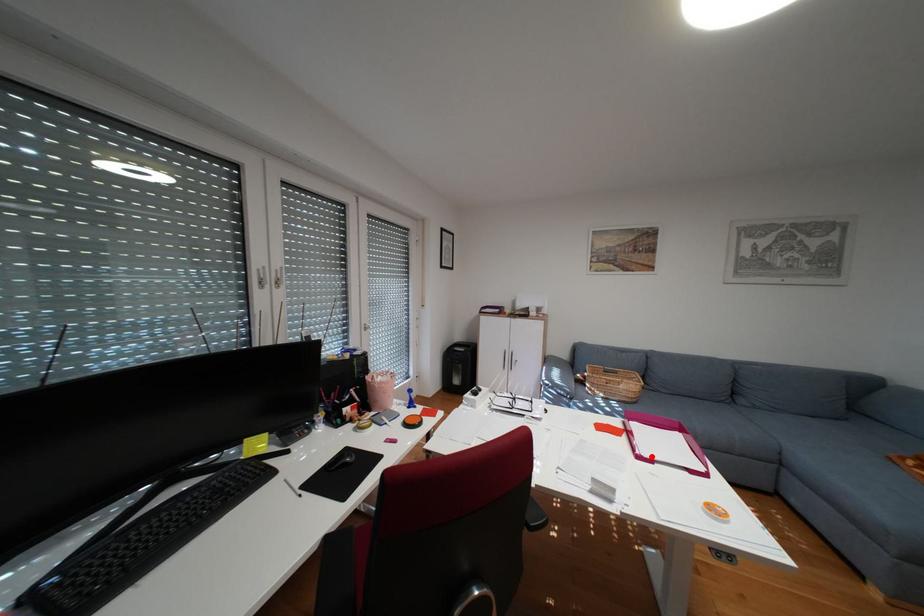
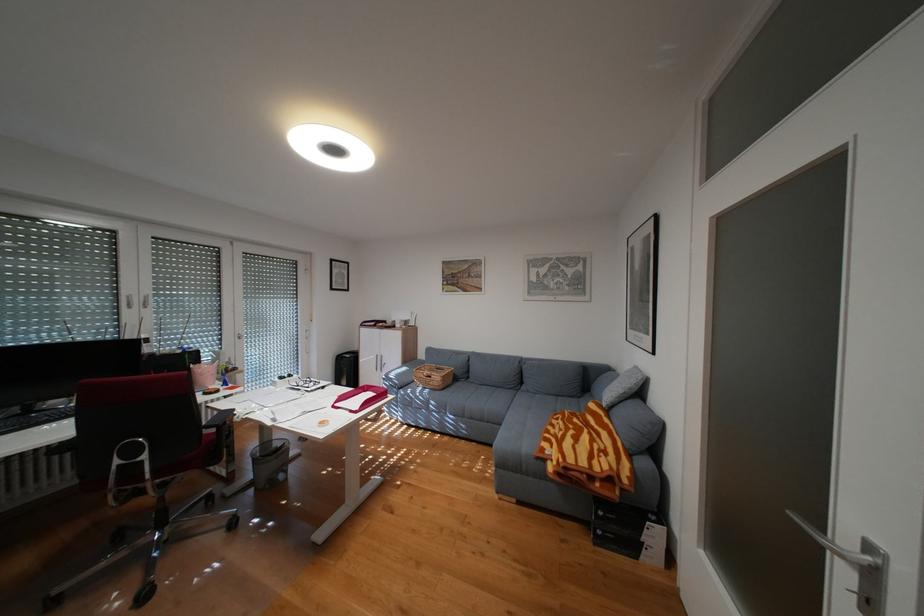
Find the pixel in the second image that matches the highlighted location in the first image.

(346, 406)